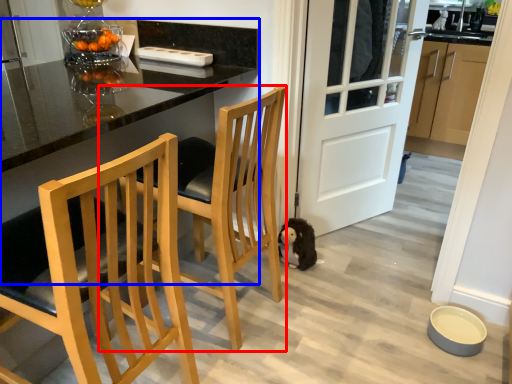
Question: Which point is closer to the camera, chair (highlighted by a red box) or table (highlighted by a blue box)?

Choices:
 (A) chair
 (B) table

Answer: (B)